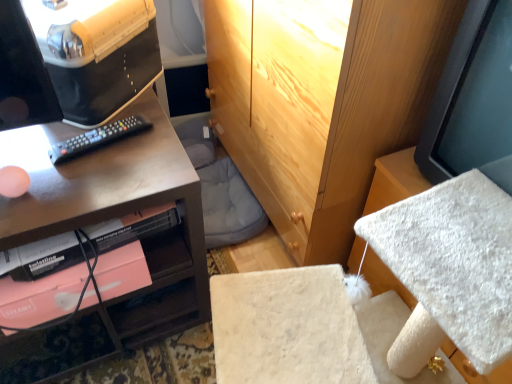
Question: From the image's perspective, is black plastic remote at left located above matte black monitor at right?

Choices:
 (A) yes
 (B) no

Answer: (B)

Question: Considering the relative sizes of black plastic remote at left and matte black monitor at right in the image provided, is black plastic remote at left wider than matte black monitor at right?

Choices:
 (A) yes
 (B) no

Answer: (B)

Question: Does black plastic remote at left appear on the right side of matte black monitor at right?

Choices:
 (A) no
 (B) yes

Answer: (A)

Question: Would you consider black plastic remote at left to be distant from matte black monitor at right?

Choices:
 (A) yes
 (B) no

Answer: (B)

Question: Can you confirm if black plastic remote at left is positioned to the left of matte black monitor at right?

Choices:
 (A) yes
 (B) no

Answer: (A)

Question: Could you tell me if black plastic remote at left is turned towards matte black monitor at right?

Choices:
 (A) no
 (B) yes

Answer: (A)

Question: From the image's perspective, is matte black monitor at right above matte black desk at left?

Choices:
 (A) no
 (B) yes

Answer: (B)

Question: Does matte black monitor at right lie behind matte black desk at left?

Choices:
 (A) no
 (B) yes

Answer: (A)

Question: Can you confirm if matte black monitor at right is wider than matte black desk at left?

Choices:
 (A) no
 (B) yes

Answer: (A)

Question: Is there a large distance between matte black monitor at right and matte black desk at left?

Choices:
 (A) no
 (B) yes

Answer: (A)

Question: From a real-world perspective, does matte black monitor at right sit lower than matte black desk at left?

Choices:
 (A) yes
 (B) no

Answer: (B)

Question: From a real-world perspective, is matte black monitor at right on matte black desk at left?

Choices:
 (A) yes
 (B) no

Answer: (A)

Question: Is black plastic remote at left completely or partially outside of matte black desk at left?

Choices:
 (A) yes
 (B) no

Answer: (B)